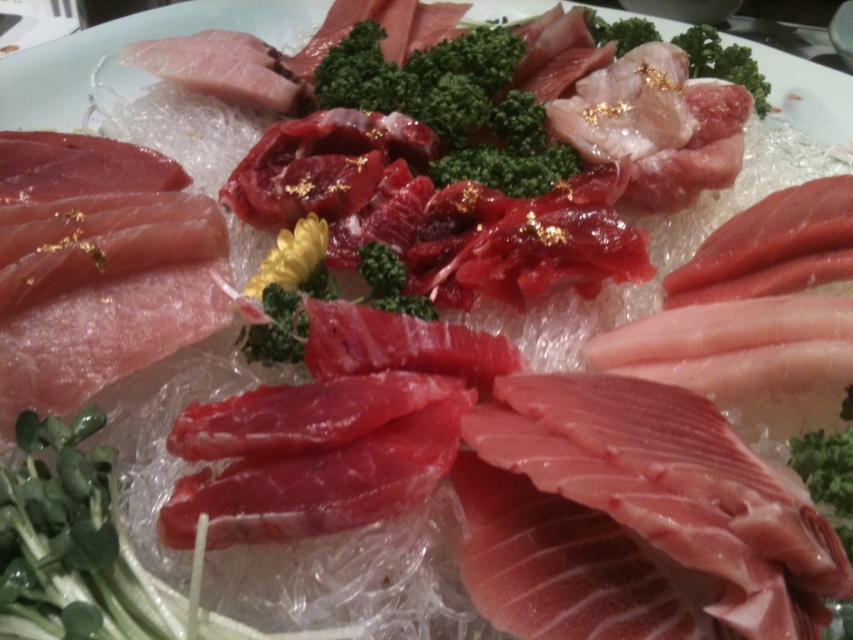
You are a chef preparing a dish and need to place a garnish between the green leafy vegetable at center and the green leafy broccoli at center on the platter. The garnish requires a minimum of 1.5 meters of space between them. Can you fit it there?

The distance between the green leafy vegetable at center and the green leafy broccoli at center is 1.33 meters, which is less than the required 1.5 meters. Therefore, the garnish cannot be placed between them with the necessary space.

You are a chef preparing a dish and need to place both the green leafy vegetable at center and the green leafy broccoli at center on a plate. According to the image, which one should you place first so that the other can be placed on top of it?

The green leafy vegetable at center should be placed first because it is positioned under the green leafy broccoli at center in the image.